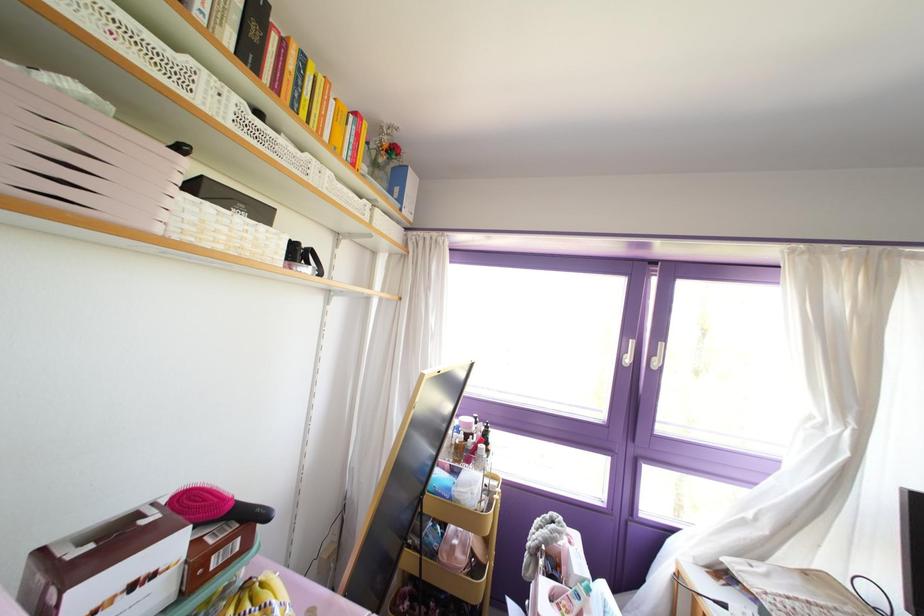
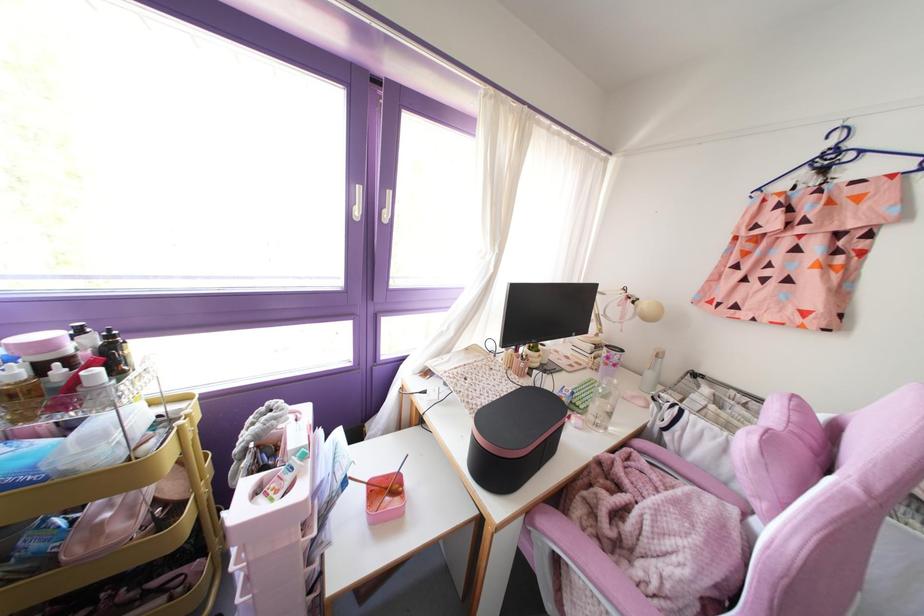
In the second image, find the point that corresponds to (x=626, y=360) in the first image.

(357, 212)